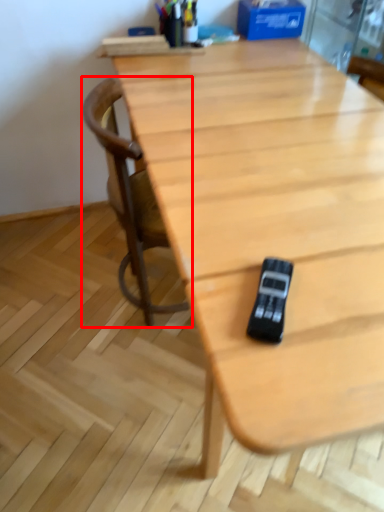
Question: From the image's perspective, where is chair (annotated by the red box) located relative to game controller?

Choices:
 (A) above
 (B) below

Answer: (A)